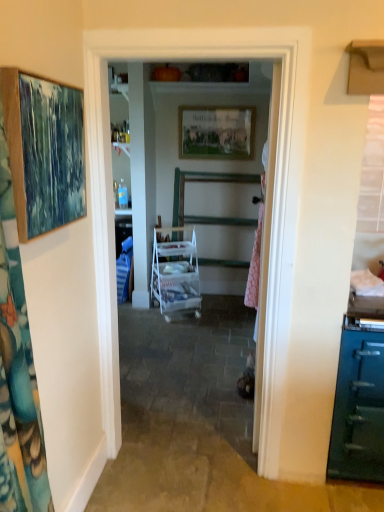
What do you see at coordinates (44, 151) in the screenshot? I see `wooden-framed painting at upper left` at bounding box center [44, 151].

In the scene shown: In order to face wooden-framed painting at upper left, should I rotate leftwards or rightwards?

You should rotate left by 18.931 degrees.

At what (x,y) coordinates should I click in order to perform the action: click on wooden-framed painting at upper left. Please return your answer as a coordinate pair (x, y). The height and width of the screenshot is (512, 384). Looking at the image, I should click on (44, 151).

What is the approximate width of wooden-framed painting at upper left?

wooden-framed painting at upper left is 3.66 inches in width.

Image resolution: width=384 pixels, height=512 pixels. I want to click on wooden-framed painting at upper left, so click(x=44, y=151).